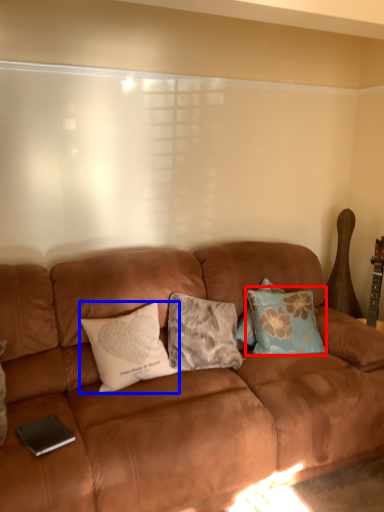
Question: Which object is closer to the camera taking this photo, pillow (highlighted by a red box) or pillow (highlighted by a blue box)?

Choices:
 (A) pillow
 (B) pillow

Answer: (B)